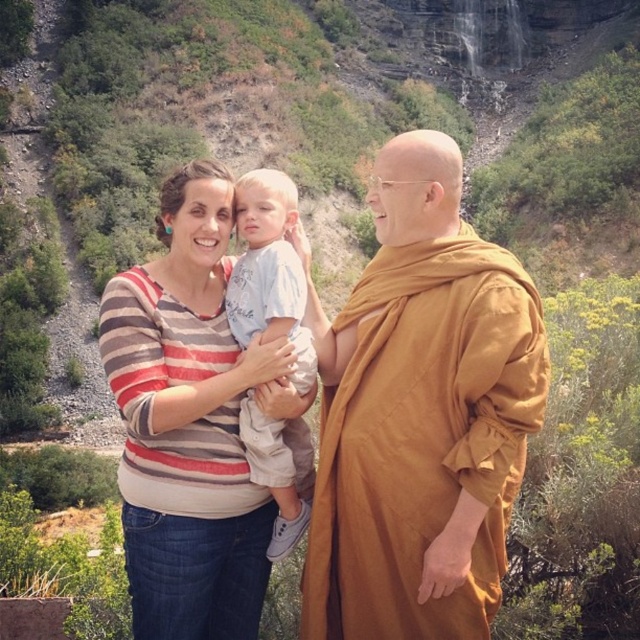
Who is more forward, (380, 396) or (138, 532)?

Point (380, 396) is more forward.

Does brown clothed monk at right appear over striped fabric shirt at center?

No, brown clothed monk at right is not above striped fabric shirt at center.

Is point (429, 365) closer to viewer compared to point (168, 179)?

Yes, it is in front of point (168, 179).

Where is `brown clothed monk at right`? The height and width of the screenshot is (640, 640). brown clothed monk at right is located at coordinates (419, 413).

Can you confirm if brown clothed monk at right is positioned to the left of light blue cotton shirt at center?

In fact, brown clothed monk at right is to the right of light blue cotton shirt at center.

Which of these two, brown clothed monk at right or light blue cotton shirt at center, stands shorter?

With less height is light blue cotton shirt at center.

The image size is (640, 640). What do you see at coordinates (419, 413) in the screenshot?
I see `brown clothed monk at right` at bounding box center [419, 413].

I want to click on brown clothed monk at right, so click(419, 413).

Which is in front, point (134, 630) or point (288, 445)?

Point (134, 630)

Is striped fabric shirt at center further to the viewer compared to light blue cotton shirt at center?

No, it is in front of light blue cotton shirt at center.

Locate an element on the screen. This screenshot has height=640, width=640. striped fabric shirt at center is located at coordinates (192, 422).

Where is `striped fabric shirt at center`? The image size is (640, 640). striped fabric shirt at center is located at coordinates (192, 422).